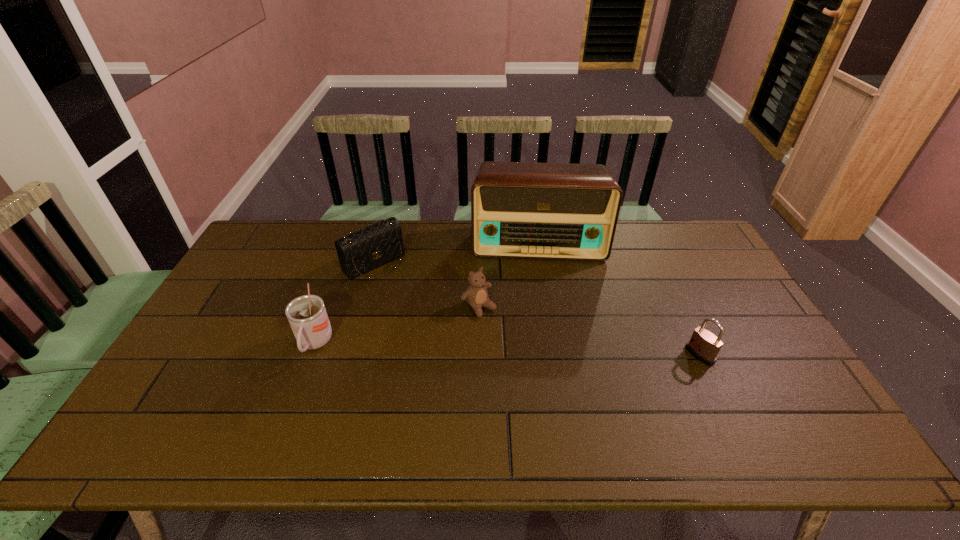
This screenshot has height=540, width=960. What are the coordinates of `vacant space at the left edge of the desktop` in the screenshot? It's located at (217, 325).

This screenshot has width=960, height=540. I want to click on free spot at the right edge of the desktop, so click(716, 274).

Locate an element on the screen. The width and height of the screenshot is (960, 540). vacant space at the far left corner of the desktop is located at coordinates (265, 227).

At what (x,y) coordinates should I click in order to perform the action: click on vacant space at the near left corner of the desktop. Please return your answer as a coordinate pair (x, y). This screenshot has height=540, width=960. Looking at the image, I should click on (223, 385).

Identify the location of empty location between the padlock and the cup. The image size is (960, 540). (507, 349).

The width and height of the screenshot is (960, 540). I want to click on free space between the rightmost object and the teddy bear, so click(x=589, y=331).

The height and width of the screenshot is (540, 960). What are the coordinates of `free space between the clutch bag and the cup` in the screenshot? It's located at (345, 303).

You are a GUI agent. You are given a task and a screenshot of the screen. Output one action in this format:
    pyautogui.click(x=<x>, y=<y>)
    Task: Click on the vacant space that's between the third nearest object and the tallest object
    
    Given the screenshot: What is the action you would take?
    pyautogui.click(x=508, y=274)

Image resolution: width=960 pixels, height=540 pixels. Identify the location of vacant area that lies between the teddy bear and the cup. (396, 325).

You are a GUI agent. You are given a task and a screenshot of the screen. Output one action in this format:
    pyautogui.click(x=<x>, y=<y>)
    Task: Click on the free spot between the padlock and the cup
    
    Given the screenshot: What is the action you would take?
    pyautogui.click(x=507, y=349)